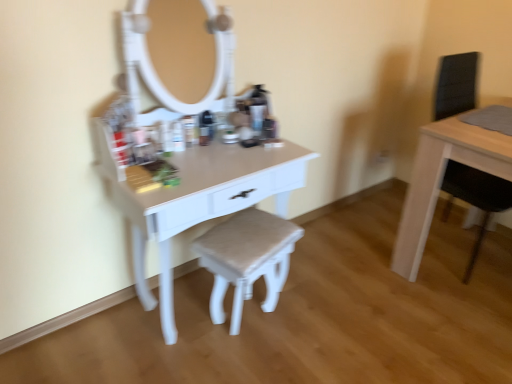
Question: From a real-world perspective, is white glossy table at center, marked as the 1th table in a left-to-right arrangement, over matte white stool at center?

Choices:
 (A) yes
 (B) no

Answer: (A)

Question: Does white glossy table at center, which ranks as the 2th table in right-to-left order, contain matte white stool at center?

Choices:
 (A) no
 (B) yes

Answer: (B)

Question: Can you confirm if white glossy table at center, which ranks as the 2th table in right-to-left order, is smaller than matte white stool at center?

Choices:
 (A) yes
 (B) no

Answer: (B)

Question: Can you confirm if white glossy table at center, marked as the 1th table in a left-to-right arrangement, is positioned to the right of matte white stool at center?

Choices:
 (A) no
 (B) yes

Answer: (A)

Question: Does white glossy table at center, marked as the 1th table in a left-to-right arrangement, have a greater height compared to matte white stool at center?

Choices:
 (A) yes
 (B) no

Answer: (A)

Question: In the image, is matte white stool at center positioned in front of or behind white glossy table at center, marked as the 1th table in a left-to-right arrangement?

Choices:
 (A) front
 (B) behind

Answer: (B)

Question: In the image, is matte white stool at center on the left side or the right side of white glossy table at center, which ranks as the 2th table in right-to-left order?

Choices:
 (A) left
 (B) right

Answer: (B)

Question: Looking at their shapes, would you say matte white stool at center is wider or thinner than white glossy table at center, marked as the 1th table in a left-to-right arrangement?

Choices:
 (A) thin
 (B) wide

Answer: (A)

Question: Looking at the image, does matte white stool at center seem bigger or smaller compared to white glossy table at center, marked as the 1th table in a left-to-right arrangement?

Choices:
 (A) small
 (B) big

Answer: (A)

Question: Based on their sizes in the image, would you say light wood table at right, the 2th table in the left-to-right sequence, is bigger or smaller than matte white stool at center?

Choices:
 (A) small
 (B) big

Answer: (B)

Question: From a real-world perspective, is light wood table at right, acting as the first table starting from the right, positioned above or below matte white stool at center?

Choices:
 (A) below
 (B) above

Answer: (B)

Question: Considering the positions of point (480, 150) and point (207, 231), is point (480, 150) closer or farther from the camera than point (207, 231)?

Choices:
 (A) farther
 (B) closer

Answer: (B)

Question: From the image's perspective, is light wood table at right, acting as the first table starting from the right, located above or below matte white stool at center?

Choices:
 (A) above
 (B) below

Answer: (A)

Question: Is point (259, 158) closer or farther from the camera than point (253, 223)?

Choices:
 (A) closer
 (B) farther

Answer: (A)

Question: Is white glossy table at center, which ranks as the 2th table in right-to-left order, situated inside matte white stool at center or outside?

Choices:
 (A) outside
 (B) inside

Answer: (A)